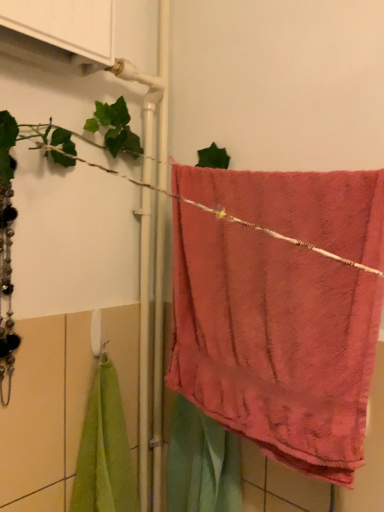
Question: From a real-world perspective, is coral plush towel at center above or below white plastic towel bar at center?

Choices:
 (A) below
 (B) above

Answer: (B)

Question: From the image's perspective, is coral plush towel at center positioned above or below white plastic towel bar at center?

Choices:
 (A) above
 (B) below

Answer: (A)

Question: Which is correct: coral plush towel at center is inside white plastic towel bar at center, or outside of it?

Choices:
 (A) inside
 (B) outside

Answer: (B)

Question: Relative to coral plush towel at center, is white plastic towel bar at center in front or behind?

Choices:
 (A) behind
 (B) front

Answer: (A)

Question: Would you say white plastic towel bar at center is inside or outside coral plush towel at center?

Choices:
 (A) inside
 (B) outside

Answer: (B)

Question: From the image's perspective, relative to coral plush towel at center, is white plastic towel bar at center above or below?

Choices:
 (A) below
 (B) above

Answer: (A)

Question: From a real-world perspective, relative to coral plush towel at center, is white plastic towel bar at center vertically above or below?

Choices:
 (A) above
 (B) below

Answer: (B)